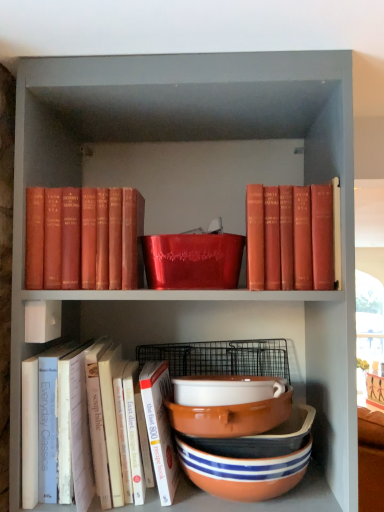
Question: Could you tell me if white paper book at lower left, which ranks as the second book in left-to-right order, is facing striped ceramic bowls at lower center, which appears as the second bowl when viewed from the top?

Choices:
 (A) no
 (B) yes

Answer: (A)

Question: Is white paper book at lower left, placed as the 3th book when sorted from top to bottom, oriented away from striped ceramic bowls at lower center, which is the second bowl from bottom to top?

Choices:
 (A) no
 (B) yes

Answer: (A)

Question: Can you confirm if white paper book at lower left, which appears as the 2th book when viewed from the right, is positioned to the left of striped ceramic bowls at lower center, which appears as the second bowl when viewed from the top?

Choices:
 (A) no
 (B) yes

Answer: (B)

Question: Is white paper book at lower left, which appears as the 2th book when viewed from the right, completely or partially outside of striped ceramic bowls at lower center, which appears as the second bowl when viewed from the top?

Choices:
 (A) yes
 (B) no

Answer: (A)

Question: Considering the relative sizes of white paper book at lower left, which appears as the 2th book when viewed from the right, and striped ceramic bowls at lower center, which is the second bowl from bottom to top, in the image provided, is white paper book at lower left, which appears as the 2th book when viewed from the right, smaller than striped ceramic bowls at lower center, which is the second bowl from bottom to top,?

Choices:
 (A) yes
 (B) no

Answer: (B)

Question: Considering the positions of white ceramic bowl at center, which is counted as the 1th bowl, starting from the top, and white paper book at lower left, placed as the 3th book when sorted from top to bottom, in the image, is white ceramic bowl at center, which is counted as the 1th bowl, starting from the top, taller or shorter than white paper book at lower left, placed as the 3th book when sorted from top to bottom,?

Choices:
 (A) short
 (B) tall

Answer: (A)

Question: In the image, is white ceramic bowl at center, the third bowl positioned from the bottom, on the left side or the right side of white paper book at lower left, which ranks as the second book in left-to-right order?

Choices:
 (A) right
 (B) left

Answer: (A)

Question: In the image, is white ceramic bowl at center, which is counted as the 1th bowl, starting from the top, positioned in front of or behind white paper book at lower left, which appears as the 2th book when viewed from the right?

Choices:
 (A) behind
 (B) front

Answer: (A)

Question: From a real-world perspective, relative to white paper book at lower left, placed as the 3th book when sorted from top to bottom, is white ceramic bowl at center, the third bowl positioned from the bottom, vertically above or below?

Choices:
 (A) above
 (B) below

Answer: (A)

Question: Is terracotta ceramic bowl at lower center, arranged as the 1th bowl when ordered from the bottom, wider or thinner than white paper book at lower left, which ranks as the second book in left-to-right order?

Choices:
 (A) thin
 (B) wide

Answer: (A)

Question: Looking at the image, does terracotta ceramic bowl at lower center, arranged as the 1th bowl when ordered from the bottom, seem bigger or smaller compared to white paper book at lower left, placed as the 3th book when sorted from top to bottom?

Choices:
 (A) small
 (B) big

Answer: (A)

Question: In the image, is terracotta ceramic bowl at lower center, arranged as the 1th bowl when ordered from the bottom, positioned in front of or behind white paper book at lower left, which ranks as the second book in left-to-right order?

Choices:
 (A) front
 (B) behind

Answer: (B)

Question: Is terracotta ceramic bowl at lower center, the 3th bowl in the top-to-bottom sequence, situated inside white paper book at lower left, which ranks as the second book in left-to-right order, or outside?

Choices:
 (A) inside
 (B) outside

Answer: (B)

Question: From the image's perspective, is striped ceramic bowls at lower center, which is the second bowl from bottom to top, above or below terracotta ceramic bowl at lower center, the 3th bowl in the top-to-bottom sequence?

Choices:
 (A) above
 (B) below

Answer: (A)

Question: In terms of height, does striped ceramic bowls at lower center, which is the second bowl from bottom to top, look taller or shorter compared to terracotta ceramic bowl at lower center, arranged as the 1th bowl when ordered from the bottom?

Choices:
 (A) tall
 (B) short

Answer: (B)